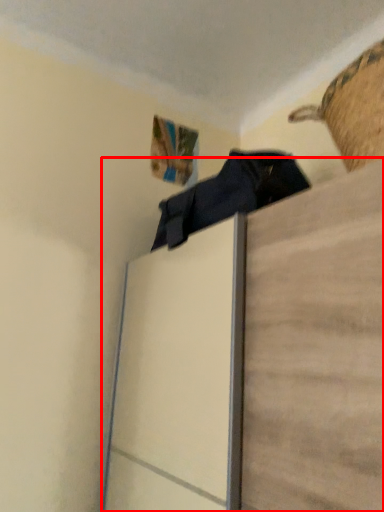
Question: Where is furniture (annotated by the red box) located in relation to basket in the image?

Choices:
 (A) left
 (B) right

Answer: (A)